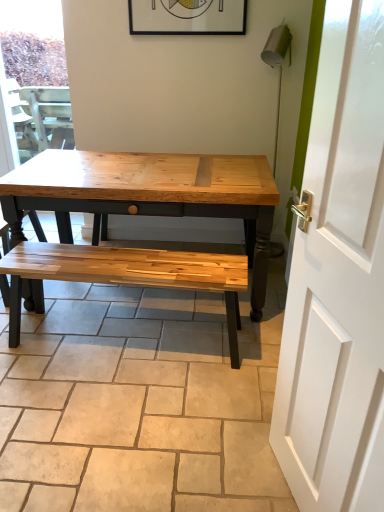
Question: Should I look upward or downward to see matte black picture frame at upper center?

Choices:
 (A) up
 (B) down

Answer: (A)